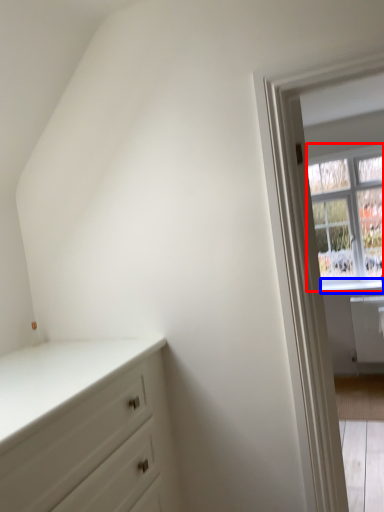
Question: Which point is further to the camera, window (highlighted by a red box) or window sill (highlighted by a blue box)?

Choices:
 (A) window
 (B) window sill

Answer: (B)